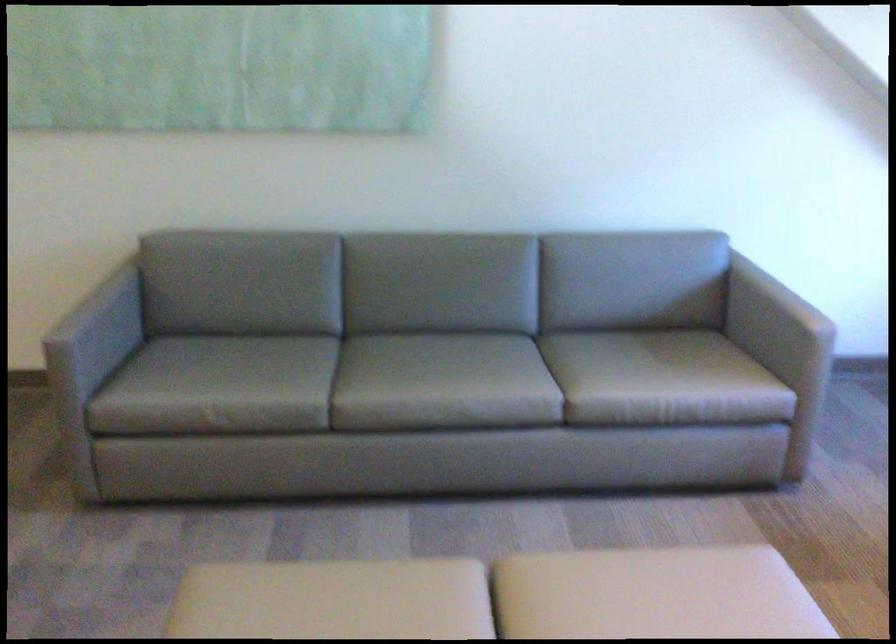
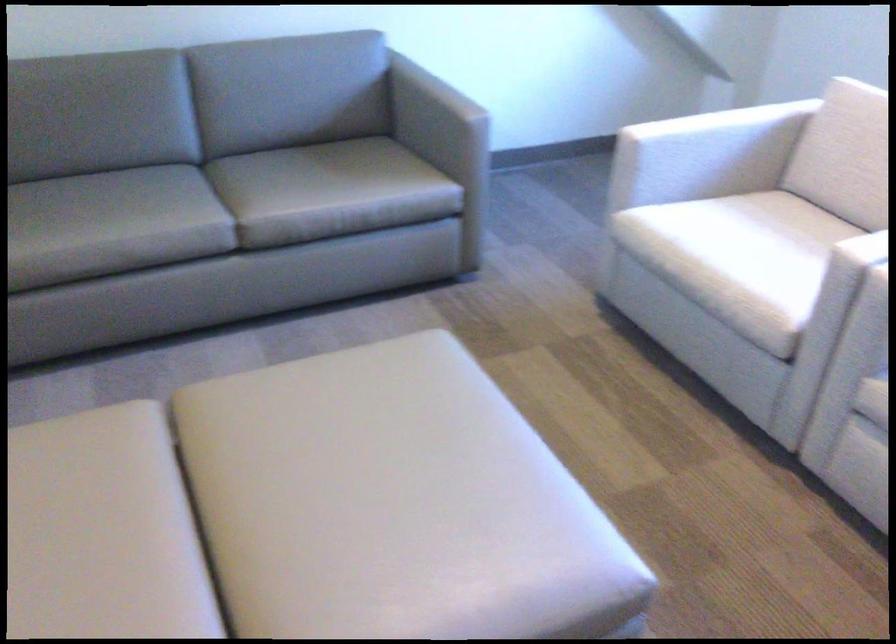
Where in the second image is the point corresponding to point (636, 363) from the first image?

(306, 174)